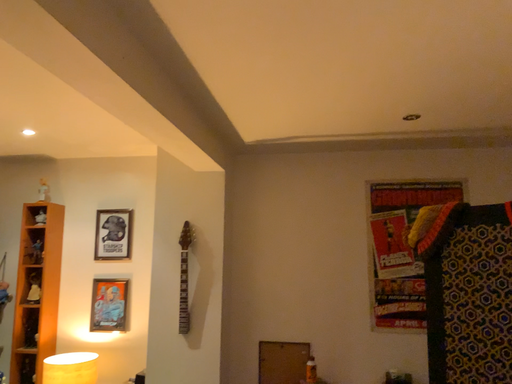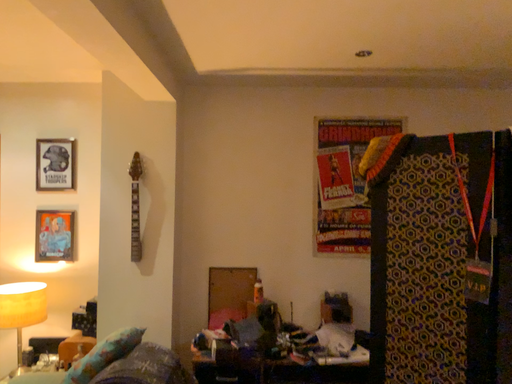
Question: How did the camera likely rotate when shooting the video?

Choices:
 (A) rotated downward
 (B) rotated upward

Answer: (A)